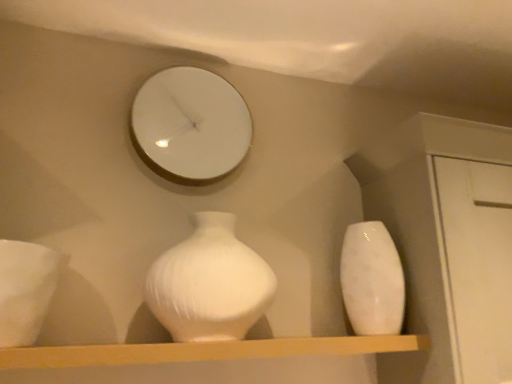
Locate an element on the screen. This screenshot has height=384, width=512. white glossy vase at right, the 1th vase positioned from the right is located at coordinates (372, 280).

Image resolution: width=512 pixels, height=384 pixels. Describe the element at coordinates (204, 351) in the screenshot. I see `smooth wooden shelf at center` at that location.

Locate an element on the screen. The image size is (512, 384). white glossy vase at right, the second vase viewed from the left is located at coordinates (372, 280).

From the image's perspective, is white glossy vase at right, the 1th vase positioned from the right, on smooth wooden shelf at center?

Yes.

Considering their positions, is white glossy vase at right, the 1th vase positioned from the right, located in front of or behind smooth wooden shelf at center?

Visually, white glossy vase at right, the 1th vase positioned from the right, is located behind smooth wooden shelf at center.

From a real-world perspective, who is located lower, white glossy vase at right, the 1th vase positioned from the right, or smooth wooden shelf at center?

smooth wooden shelf at center, from a real-world perspective.

At what (x,y) coordinates should I click in order to perform the action: click on the 2nd vase above the smooth wooden shelf at center (from a real-world perspective). Please return your answer as a coordinate pair (x, y). This screenshot has height=384, width=512. Looking at the image, I should click on [372, 280].

Between white glossy vase at right, the 1th vase positioned from the right, and white glossy vase at center, arranged as the 1th vase when viewed from the left, which one has smaller width?

With smaller width is white glossy vase at right, the 1th vase positioned from the right.

Is white glossy vase at right, the second vase viewed from the left, not near white glossy vase at center, arranged as the 1th vase when viewed from the left?

white glossy vase at right, the second vase viewed from the left, is actually quite close to white glossy vase at center, arranged as the 1th vase when viewed from the left.

Considering the sizes of objects white glossy vase at right, the second vase viewed from the left, and white glossy vase at center, marked as the 2th vase in a right-to-left arrangement, in the image provided, who is shorter, white glossy vase at right, the second vase viewed from the left, or white glossy vase at center, marked as the 2th vase in a right-to-left arrangement,?

Standing shorter between the two is white glossy vase at center, marked as the 2th vase in a right-to-left arrangement.

Is white glossy vase at right, the second vase viewed from the left, outside of white glossy vase at center, arranged as the 1th vase when viewed from the left?

Yes, white glossy vase at right, the second vase viewed from the left, is not within white glossy vase at center, arranged as the 1th vase when viewed from the left.

Consider the image. Is there a large distance between white glossy vase at left and smooth wooden shelf at center?

That's not correct — white glossy vase at left is a little close to smooth wooden shelf at center.

From a real-world perspective, which object stands above the other?

white glossy vase at left, from a real-world perspective.

Is white glossy vase at left shorter than smooth wooden shelf at center?

No, white glossy vase at left is not shorter than smooth wooden shelf at center.

At what (x,y) coordinates should I click in order to perform the action: click on porcelain above the smooth wooden shelf at center (from a real-world perspective). Please return your answer as a coordinate pair (x, y). Looking at the image, I should click on (25, 290).

Which is nearer, (354, 257) or (36, 307)?

Point (354, 257) is farther from the camera than point (36, 307).

Is white glossy vase at right, the second vase viewed from the left, bigger than white glossy vase at left?

Correct, white glossy vase at right, the second vase viewed from the left, is larger in size than white glossy vase at left.

From a real-world perspective, is white glossy vase at right, the 1th vase positioned from the right, physically above white glossy vase at left?

Yes, from a real-world perspective, white glossy vase at right, the 1th vase positioned from the right, is on top of white glossy vase at left.

Locate an element on the screen. The image size is (512, 384). porcelain located underneath the white glossy vase at right, the second vase viewed from the left (from a real-world perspective) is located at coordinates (25, 290).

Is white glossy vase at left placed right next to white glossy mirror at upper center?

white glossy vase at left and white glossy mirror at upper center are clearly separated.

Based on the photo, is white glossy mirror at upper center inside white glossy vase at left?

No, white glossy mirror at upper center is located outside of white glossy vase at left.

From a real-world perspective, is white glossy vase at left on white glossy mirror at upper center?

No, from a real-world perspective, white glossy vase at left is not above white glossy mirror at upper center.

From the image's perspective, does white glossy vase at left appear higher than white glossy mirror at upper center?

No, from the image's perspective, white glossy vase at left is not over white glossy mirror at upper center.

How distant is smooth wooden shelf at center from white glossy vase at center, marked as the 2th vase in a right-to-left arrangement?

A distance of 6.06 inches exists between smooth wooden shelf at center and white glossy vase at center, marked as the 2th vase in a right-to-left arrangement.

Can you confirm if smooth wooden shelf at center is positioned to the right of white glossy vase at center, arranged as the 1th vase when viewed from the left?

Yes, smooth wooden shelf at center is to the right of white glossy vase at center, arranged as the 1th vase when viewed from the left.

From a real-world perspective, is smooth wooden shelf at center physically below white glossy vase at center, marked as the 2th vase in a right-to-left arrangement?

Yes, from a real-world perspective, smooth wooden shelf at center is below white glossy vase at center, marked as the 2th vase in a right-to-left arrangement.

From the image's perspective, is smooth wooden shelf at center beneath white glossy vase at center, arranged as the 1th vase when viewed from the left?

Correct, smooth wooden shelf at center appears lower than white glossy vase at center, arranged as the 1th vase when viewed from the left, in the image.

How far apart are white glossy vase at right, the second vase viewed from the left, and white glossy mirror at upper center?

white glossy vase at right, the second vase viewed from the left, and white glossy mirror at upper center are 22.80 inches apart.

From the picture: Based on their sizes in the image, would you say white glossy vase at right, the 1th vase positioned from the right, is bigger or smaller than white glossy mirror at upper center?

Clearly, white glossy vase at right, the 1th vase positioned from the right, is larger in size than white glossy mirror at upper center.

From a real-world perspective, who is located lower, white glossy vase at right, the 1th vase positioned from the right, or white glossy mirror at upper center?

In real-world perspective, white glossy vase at right, the 1th vase positioned from the right, is lower.

Is white glossy vase at right, the 1th vase positioned from the right, in contact with white glossy mirror at upper center?

No, white glossy vase at right, the 1th vase positioned from the right, is not making contact with white glossy mirror at upper center.

Where is `the 1st vase above the smooth wooden shelf at center (from the image's perspective)`? the 1st vase above the smooth wooden shelf at center (from the image's perspective) is located at coordinates (372, 280).

Find the location of a particular element. Image resolution: width=512 pixels, height=384 pixels. vase that is below the white glossy vase at center, arranged as the 1th vase when viewed from the left (from the image's perspective) is located at coordinates (372, 280).

Looking at the image, which one is located closer to white glossy mirror at upper center, white glossy vase at center, arranged as the 1th vase when viewed from the left, or white glossy vase at left?

white glossy vase at center, arranged as the 1th vase when viewed from the left, is closer to white glossy mirror at upper center.

Estimate the real-world distances between objects in this image. Which object is further from white glossy mirror at upper center, white glossy vase at center, arranged as the 1th vase when viewed from the left, or white glossy vase at right, the second vase viewed from the left?

Among the two, white glossy vase at right, the second vase viewed from the left, is located further to white glossy mirror at upper center.

When comparing their distances from white glossy mirror at upper center, does white glossy vase at left or smooth wooden shelf at center seem further?

The object further to white glossy mirror at upper center is smooth wooden shelf at center.

Estimate the real-world distances between objects in this image. Which object is further from white glossy vase at right, the second vase viewed from the left, white glossy vase at center, marked as the 2th vase in a right-to-left arrangement, or white glossy mirror at upper center?

white glossy mirror at upper center is positioned further to the anchor white glossy vase at right, the second vase viewed from the left.

From the image, which object appears to be farther from smooth wooden shelf at center, white glossy vase at right, the 1th vase positioned from the right, or white glossy vase at left?

white glossy vase at right, the 1th vase positioned from the right, lies further to smooth wooden shelf at center than the other object.

Looking at the image, which one is located closer to white glossy mirror at upper center, white glossy vase at left or white glossy vase at right, the 1th vase positioned from the right?

white glossy vase at left.

Which object lies nearer to the anchor point white glossy vase at left, white glossy vase at right, the second vase viewed from the left, or white glossy vase at center, marked as the 2th vase in a right-to-left arrangement?

white glossy vase at center, marked as the 2th vase in a right-to-left arrangement.

Looking at the image, which one is located closer to smooth wooden shelf at center, white glossy mirror at upper center or white glossy vase at right, the 1th vase positioned from the right?

white glossy vase at right, the 1th vase positioned from the right, lies closer to smooth wooden shelf at center than the other object.

Where is `porcelain between white glossy mirror at upper center and smooth wooden shelf at center in the up-down direction`? The image size is (512, 384). porcelain between white glossy mirror at upper center and smooth wooden shelf at center in the up-down direction is located at coordinates (25, 290).

I want to click on shelf between white glossy vase at center, marked as the 2th vase in a right-to-left arrangement, and white glossy vase at right, the 1th vase positioned from the right, in the horizontal direction, so click(x=204, y=351).

Find the location of a particular element. The width and height of the screenshot is (512, 384). shelf between white glossy vase at left and white glossy vase at right, the second vase viewed from the left, from left to right is located at coordinates (204, 351).

Locate an element on the screen. This screenshot has width=512, height=384. vase located between white glossy mirror at upper center and white glossy vase at right, the 1th vase positioned from the right, in the left-right direction is located at coordinates 209,284.